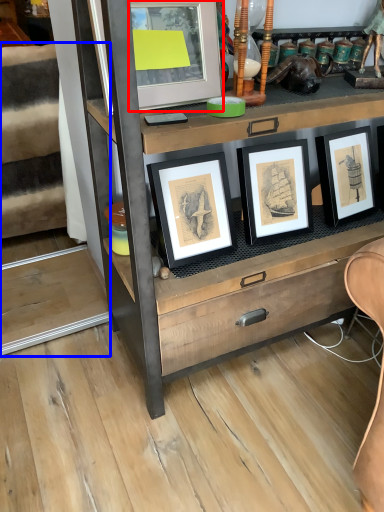
Question: Which point is further to the camera, picture frame (highlighted by a red box) or stairwell (highlighted by a blue box)?

Choices:
 (A) picture frame
 (B) stairwell

Answer: (B)